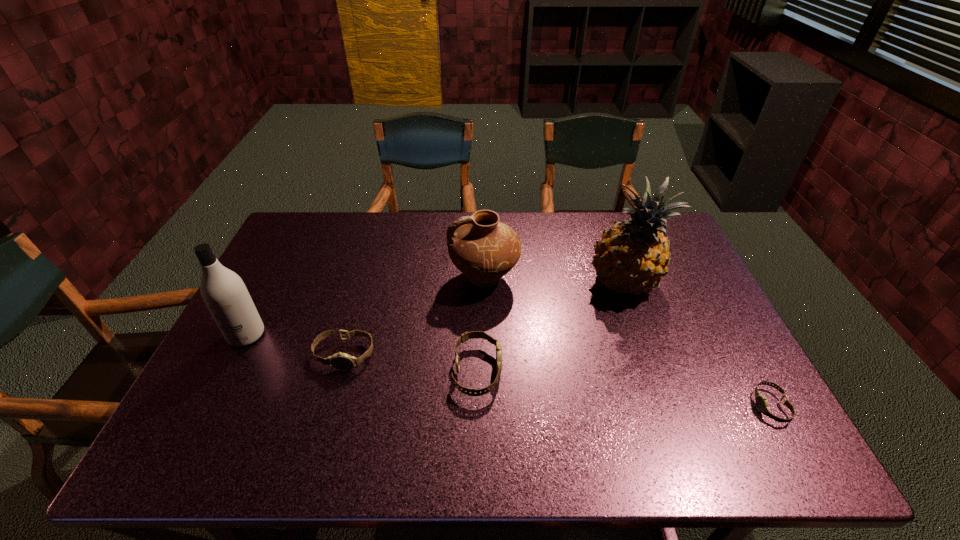
Identify the location of watch located at the right edge. Image resolution: width=960 pixels, height=540 pixels. (761, 401).

At what (x,y) coordinates should I click in order to perform the action: click on pineapple positioned at the right edge. Please return your answer as a coordinate pair (x, y). The width and height of the screenshot is (960, 540). Looking at the image, I should click on (632, 256).

You are a GUI agent. You are given a task and a screenshot of the screen. Output one action in this format:
    pyautogui.click(x=<x>, y=<y>)
    Task: Click on the object that is at the near right corner
    The height and width of the screenshot is (540, 960).
    Given the screenshot: What is the action you would take?
    pyautogui.click(x=761, y=401)

I want to click on vacant space at the far edge, so click(551, 254).

The height and width of the screenshot is (540, 960). In order to click on vacant area at the near edge of the desktop in this screenshot , I will do `click(308, 410)`.

Image resolution: width=960 pixels, height=540 pixels. In the image, there is a desktop. In order to click on vacant space at the left edge in this screenshot , I will do [x=266, y=377].

Image resolution: width=960 pixels, height=540 pixels. I want to click on vacant space at the right edge of the desktop, so click(x=725, y=355).

Locate an element on the screen. The height and width of the screenshot is (540, 960). free space at the far left corner of the desktop is located at coordinates (319, 212).

Where is `free location at the near left corner`? free location at the near left corner is located at coordinates (232, 420).

In order to click on empty location between the fifth object from left to right and the fourth shortest object in this screenshot , I will do `click(554, 280)`.